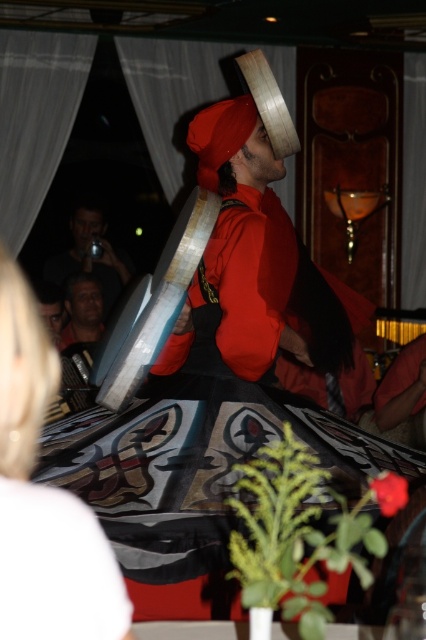
Question: Which of the following is the closest to the observer?

Choices:
 (A) (58, 253)
 (B) (81, 321)
 (C) (34, 397)

Answer: (C)

Question: Which of these objects is positioned farthest from the matte black face at center?

Choices:
 (A) blonde hair at upper left
 (B) matte black camera at upper left

Answer: (A)

Question: Is matte black camera at upper left bigger than matte black face at center?

Choices:
 (A) no
 (B) yes

Answer: (B)

Question: Can you confirm if matte black camera at upper left is positioned to the right of matte black face at center?

Choices:
 (A) no
 (B) yes

Answer: (A)

Question: Does matte black camera at upper left have a lesser width compared to matte black face at center?

Choices:
 (A) no
 (B) yes

Answer: (A)

Question: Which object appears closest to the camera in this image?

Choices:
 (A) matte black face at center
 (B) blonde hair at upper left
 (C) matte black camera at upper left

Answer: (B)